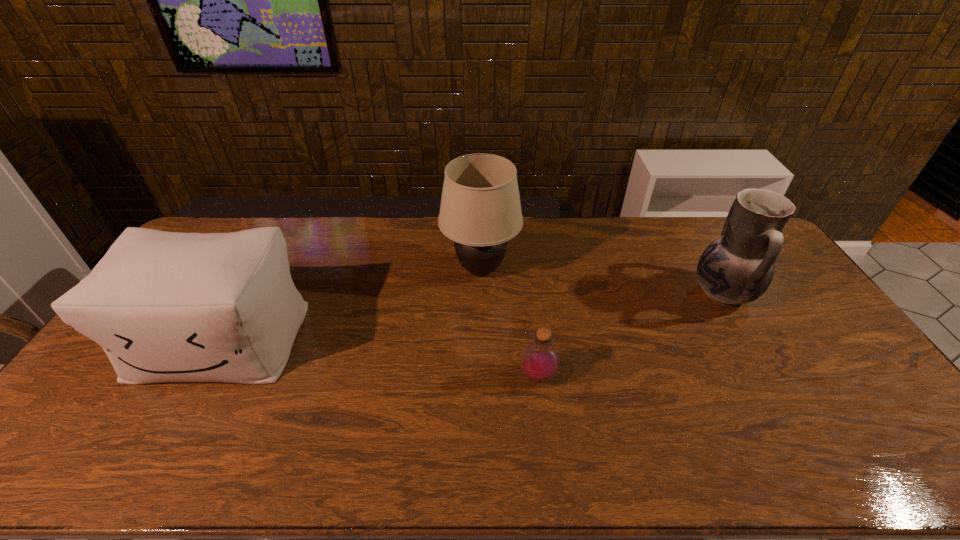
Where is `vacant area that lies between the bottle and the cushion`? The image size is (960, 540). vacant area that lies between the bottle and the cushion is located at coordinates (379, 358).

At what (x,y) coordinates should I click in order to perform the action: click on unoccupied area between the leftmost object and the shortest object. Please return your answer as a coordinate pair (x, y). This screenshot has width=960, height=540. Looking at the image, I should click on (379, 358).

Image resolution: width=960 pixels, height=540 pixels. I want to click on unoccupied position between the lampshade and the shortest object, so click(x=509, y=323).

I want to click on vacant area that lies between the cushion and the lampshade, so click(350, 305).

You are a GUI agent. You are given a task and a screenshot of the screen. Output one action in this format:
    pyautogui.click(x=<x>, y=<y>)
    Task: Click on the vacant space that's between the pitcher and the cushion
    Image resolution: width=960 pixels, height=540 pixels.
    Given the screenshot: What is the action you would take?
    pyautogui.click(x=471, y=316)

At what (x,y) coordinates should I click in order to perform the action: click on vacant area that lies between the lampshade and the bottle. Please return your answer as a coordinate pair (x, y). The height and width of the screenshot is (540, 960). Looking at the image, I should click on (509, 323).

Locate an element on the screen. This screenshot has width=960, height=540. vacant area that lies between the shortest object and the cushion is located at coordinates (379, 358).

The image size is (960, 540). Find the location of `object that is the second closest to the cushion`. object that is the second closest to the cushion is located at coordinates (540, 360).

Select which object is the third closest to the bottle. Please provide its 2D coordinates. Your answer should be formatted as a tuple, i.e. [(x, y)], where the tuple contains the x and y coordinates of a point satisfying the conditions above.

[(166, 307)]

I want to click on free space that satisfies the following two spatial constraints: 1. on the front side of the lampshade; 2. on the right side of the bottle, so click(x=481, y=376).